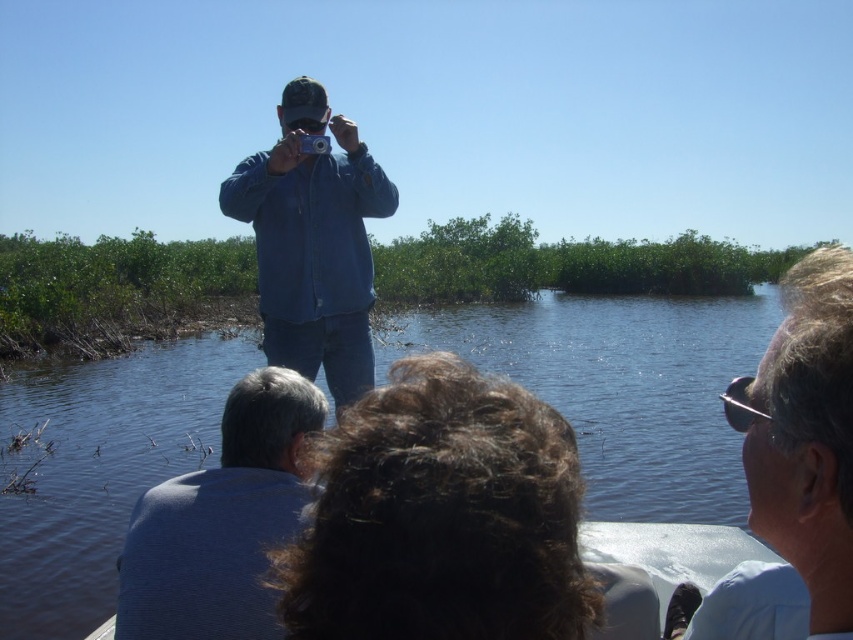
Between blue water at center and blue striped shirt at lower left, which one appears on the left side from the viewer's perspective?

blue striped shirt at lower left

Can you confirm if blue water at center is smaller than blue striped shirt at lower left?

Incorrect, blue water at center is not smaller in size than blue striped shirt at lower left.

This screenshot has width=853, height=640. I want to click on blue water at center, so click(x=622, y=388).

Which is more to the left, blue striped shirt at lower left or blue denim shirt at center?

blue denim shirt at center is more to the left.

Is blue striped shirt at lower left smaller than blue denim shirt at center?

Indeed, blue striped shirt at lower left has a smaller size compared to blue denim shirt at center.

Which is behind, point (300, 388) or point (244, 186)?

The point (244, 186) is more distant.

The height and width of the screenshot is (640, 853). I want to click on blue striped shirt at lower left, so click(x=222, y=522).

Is point (630, 300) in front of point (804, 324)?

No.

From the picture: Can you confirm if blue water at center is bigger than light blue shirt at upper right?

Actually, blue water at center might be smaller than light blue shirt at upper right.

Is point (111, 608) less distant than point (840, 324)?

No.

The image size is (853, 640). I want to click on blue water at center, so click(x=622, y=388).